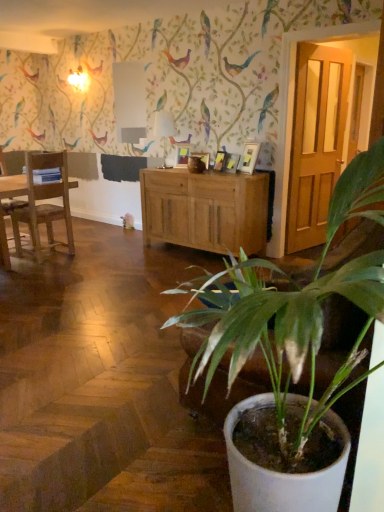
This screenshot has width=384, height=512. In order to click on white glossy lampshade at center in this screenshot , I will do `click(164, 129)`.

I want to click on light brown wood cabinet at center, so click(x=205, y=210).

The width and height of the screenshot is (384, 512). Describe the element at coordinates (44, 204) in the screenshot. I see `wooden chair at left, positioned as the second chair in left-to-right order` at that location.

How much space does wooden chair at left, which is counted as the first chair, starting from the left, occupy vertically?

1.08 meters.

The height and width of the screenshot is (512, 384). Describe the element at coordinates (219, 160) in the screenshot. I see `wooden picture frame at center, which is the second picture frame in front-to-back order` at that location.

I want to click on matte wooden picture frame at center, acting as the 1th picture frame starting from the left, so click(x=183, y=153).

The image size is (384, 512). I want to click on white glossy lampshade at center, so click(164, 129).

Is matte wooden door at right next to white glossy picture frame at upper center, which is the 1th picture frame in front-to-back order, and touching it?

No, matte wooden door at right is not touching white glossy picture frame at upper center, which is the 1th picture frame in front-to-back order.

Based on the photo, what's the angular difference between matte wooden door at right and white glossy picture frame at upper center, arranged as the third picture frame when viewed from the left,'s facing directions?

98.5 degrees separate the facing orientations of matte wooden door at right and white glossy picture frame at upper center, arranged as the third picture frame when viewed from the left.

Is white glossy picture frame at upper center, which is the third picture frame in back-to-front order, surrounded by matte wooden door at right?

No, white glossy picture frame at upper center, which is the third picture frame in back-to-front order, is not inside matte wooden door at right.

Is matte wooden door at right not near light brown wood cabinet at center?

matte wooden door at right is actually quite close to light brown wood cabinet at center.

Is matte wooden door at right facing towards light brown wood cabinet at center?

No, matte wooden door at right is not turned towards light brown wood cabinet at center.

From a real-world perspective, between matte wooden door at right and light brown wood cabinet at center, who is vertically lower?

From a 3D spatial view, light brown wood cabinet at center is below.

Between point (184, 154) and point (257, 146), which one is positioned in front?

Point (257, 146)

From a real-world perspective, who is located lower, matte wooden picture frame at center, arranged as the third picture frame when viewed from the right, or white glossy picture frame at upper center, the first picture frame from the right?

From a 3D spatial view, matte wooden picture frame at center, arranged as the third picture frame when viewed from the right, is below.

Considering the relative positions of matte wooden picture frame at center, acting as the 1th picture frame starting from the left, and white glossy picture frame at upper center, which is the third picture frame in back-to-front order, in the image provided, is matte wooden picture frame at center, acting as the 1th picture frame starting from the left, to the right of white glossy picture frame at upper center, which is the third picture frame in back-to-front order, from the viewer's perspective?

Incorrect, matte wooden picture frame at center, acting as the 1th picture frame starting from the left, is not on the right side of white glossy picture frame at upper center, which is the third picture frame in back-to-front order.

From the matte wooden picture frame at center, placed as the first picture frame when sorted from back to front, count 2nd picture frame to the right and point to it. Please provide its 2D coordinates.

[(248, 157)]

Is matte wooden door at right far from white glossy lampshade at center?

matte wooden door at right is positioned a significant distance from white glossy lampshade at center.

Can you confirm if matte wooden door at right is wider than white glossy lampshade at center?

No.

Can you confirm if matte wooden door at right is positioned to the right of white glossy lampshade at center?

Correct, you'll find matte wooden door at right to the right of white glossy lampshade at center.

Identify the location of glass door on the right side of white glossy lampshade at center. The image size is (384, 512). (316, 141).

How many degrees apart are the facing directions of light brown wood cabinet at center and matte wooden picture frame at center, placed as the first picture frame when sorted from back to front?

The angle between the facing direction of light brown wood cabinet at center and the facing direction of matte wooden picture frame at center, placed as the first picture frame when sorted from back to front, is 18.1 degrees.

Which object is wider, light brown wood cabinet at center or matte wooden picture frame at center, acting as the 1th picture frame starting from the left?

With larger width is light brown wood cabinet at center.

Considering the relative positions of light brown wood cabinet at center and matte wooden picture frame at center, arranged as the third picture frame when viewed from the right, in the image provided, is light brown wood cabinet at center to the right of matte wooden picture frame at center, arranged as the third picture frame when viewed from the right, from the viewer's perspective?

Indeed, light brown wood cabinet at center is positioned on the right side of matte wooden picture frame at center, arranged as the third picture frame when viewed from the right.

Identify the location of cabinetry below the matte wooden picture frame at center, placed as the first picture frame when sorted from back to front (from the image's perspective). This screenshot has width=384, height=512. (205, 210).

Who is smaller, wooden chair at left, positioned as the second chair in left-to-right order, or white glossy lampshade at center?

white glossy lampshade at center.

From a real-world perspective, is wooden chair at left, positioned as the second chair in left-to-right order, located higher than white glossy lampshade at center?

No, from a real-world perspective, wooden chair at left, positioned as the second chair in left-to-right order, is not above white glossy lampshade at center.

Is wooden chair at left, marked as the 1th chair in a right-to-left arrangement, thinner than white glossy lampshade at center?

No.

In the scene shown: From the image's perspective, is white matte plant pot at lower right located above matte wooden picture frame at center, acting as the 1th picture frame starting from the left?

No, from the image's perspective, white matte plant pot at lower right is not above matte wooden picture frame at center, acting as the 1th picture frame starting from the left.

Is white matte plant pot at lower right far from matte wooden picture frame at center, arranged as the third picture frame when viewed from the right?

Yes.

Based on the photo, how distant is white matte plant pot at lower right from matte wooden picture frame at center, placed as the third picture frame when sorted from front to back?

The distance of white matte plant pot at lower right from matte wooden picture frame at center, placed as the third picture frame when sorted from front to back, is 3.85 meters.

Is white matte plant pot at lower right thinner than matte wooden picture frame at center, placed as the third picture frame when sorted from front to back?

In fact, white matte plant pot at lower right might be wider than matte wooden picture frame at center, placed as the third picture frame when sorted from front to back.

Locate an element on the screen. glass door above the white glossy picture frame at upper center, which is the third picture frame in back-to-front order (from a real-world perspective) is located at coordinates (316, 141).

Where is `glass door on the right side of light brown wood cabinet at center`? glass door on the right side of light brown wood cabinet at center is located at coordinates (316, 141).

Which object lies further to the anchor point light brown wood cabinet at center, matte wooden picture frame at center, arranged as the third picture frame when viewed from the right, or white matte plant pot at lower right?

white matte plant pot at lower right is positioned further to the anchor light brown wood cabinet at center.

Considering their positions, is wooden chair at left, which is counted as the first chair, starting from the left, positioned further to light brown wood cabinet at center than wooden picture frame at center, which is the second picture frame in front-to-back order?

wooden chair at left, which is counted as the first chair, starting from the left, is further to light brown wood cabinet at center.

Which object lies further to the anchor point matte wooden picture frame at center, arranged as the third picture frame when viewed from the right, white matte plant pot at lower right or matte wooden door at right?

white matte plant pot at lower right.

From the picture: Based on their spatial positions, is wooden picture frame at center, positioned as the second picture frame in back-to-front order, or white glossy picture frame at upper center, arranged as the third picture frame when viewed from the left, further from white matte plant pot at lower right?

wooden picture frame at center, positioned as the second picture frame in back-to-front order, is further to white matte plant pot at lower right.

Looking at this image, based on their spatial positions, is white glossy picture frame at upper center, which is the third picture frame in back-to-front order, or white matte plant pot at lower right further from wooden picture frame at center, positioned as the second picture frame in back-to-front order?

white matte plant pot at lower right lies further to wooden picture frame at center, positioned as the second picture frame in back-to-front order, than the other object.

From the image, which object appears to be nearer to white glossy lampshade at center, white matte plant pot at lower right or wooden chair at left, marked as the 1th chair in a right-to-left arrangement?

wooden chair at left, marked as the 1th chair in a right-to-left arrangement, is closer to white glossy lampshade at center.

Based on their spatial positions, is light brown wood cabinet at center or wooden picture frame at center, which is the second picture frame in front-to-back order, further from wooden chair at left, positioned as the second chair in left-to-right order?

Among the two, wooden picture frame at center, which is the second picture frame in front-to-back order, is located further to wooden chair at left, positioned as the second chair in left-to-right order.

Which object lies further to the anchor point light brown wood cabinet at center, wooden chair at left, positioned as the second chair in left-to-right order, or matte wooden door at right?

wooden chair at left, positioned as the second chair in left-to-right order, lies further to light brown wood cabinet at center than the other object.

Find the location of a particular element. This screenshot has height=512, width=384. cabinetry situated between wooden chair at left, the 2th chair in the right-to-left sequence, and wooden picture frame at center, positioned as the second picture frame in back-to-front order, from left to right is located at coordinates (205, 210).

The image size is (384, 512). I want to click on lamp between wooden chair at left, the 2th chair in the right-to-left sequence, and wooden picture frame at center, positioned as the second picture frame in back-to-front order, in the horizontal direction, so click(164, 129).

You are a GUI agent. You are given a task and a screenshot of the screen. Output one action in this format:
    pyautogui.click(x=<x>, y=<y>)
    Task: Click on the chair between wooden chair at left, the 2th chair in the right-to-left sequence, and white glossy lampshade at center, in the horizontal direction
    The image size is (384, 512).
    Given the screenshot: What is the action you would take?
    pyautogui.click(x=44, y=204)

Image resolution: width=384 pixels, height=512 pixels. What are the coordinates of `chair between white matte plant pot at lower right and white glossy picture frame at upper center, arranged as the third picture frame when viewed from the left, from front to back` in the screenshot? It's located at (44, 204).